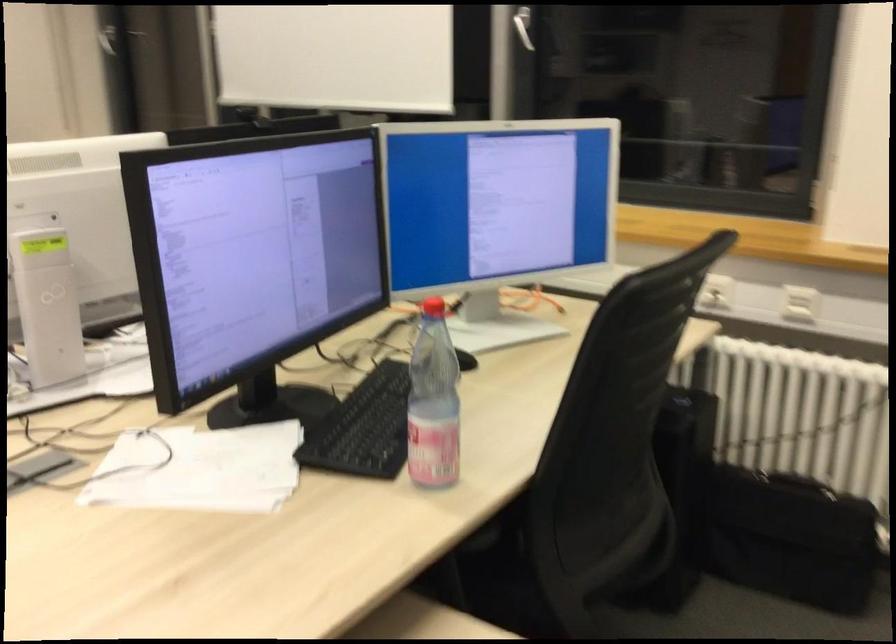
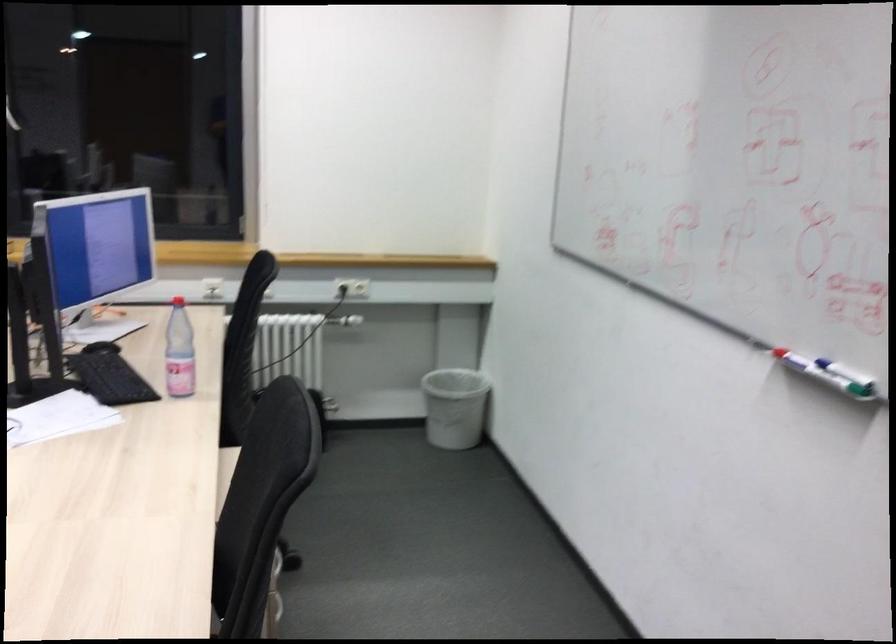
In the second image, find the point that corresponds to point (606, 366) in the first image.

(246, 319)